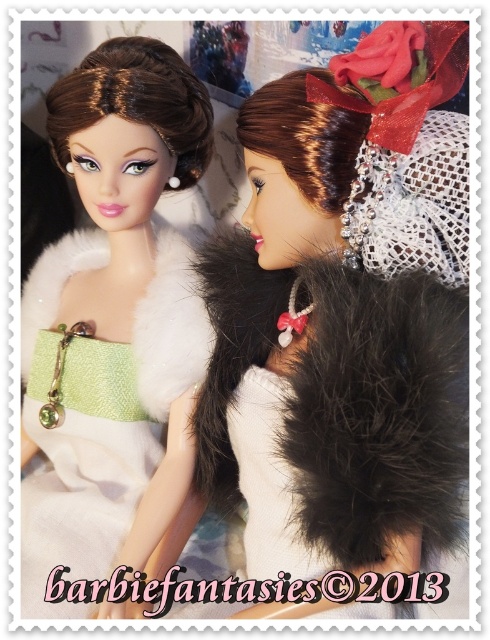
Question: Which of the following is the farthest from the observer?

Choices:
 (A) (34, 493)
 (B) (226, 368)

Answer: (A)

Question: Which object is farther from the camera taking this photo?

Choices:
 (A) matte white fur at upper left
 (B) matte white fur coat at left

Answer: (B)

Question: Which of the following is the farthest from the observer?

Choices:
 (A) matte white fur at upper left
 (B) matte white fur coat at left

Answer: (B)

Question: Can you confirm if matte white fur at upper left is positioned to the right of matte white fur coat at left?

Choices:
 (A) no
 (B) yes

Answer: (B)

Question: Can you confirm if matte white fur at upper left is wider than matte white fur coat at left?

Choices:
 (A) no
 (B) yes

Answer: (B)

Question: Where is matte white fur at upper left located in relation to matte white fur coat at left in the image?

Choices:
 (A) right
 (B) left

Answer: (A)